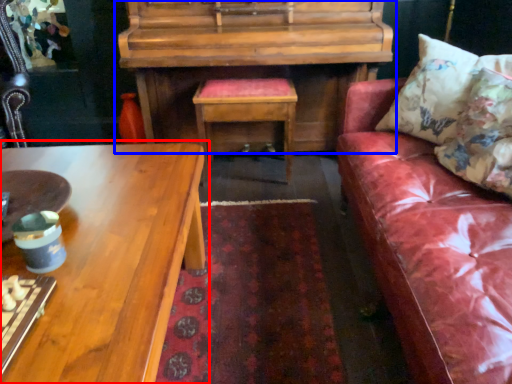
Question: Which of the following is the farthest to the observer, coffee table (highlighted by a red box) or piano (highlighted by a blue box)?

Choices:
 (A) coffee table
 (B) piano

Answer: (B)